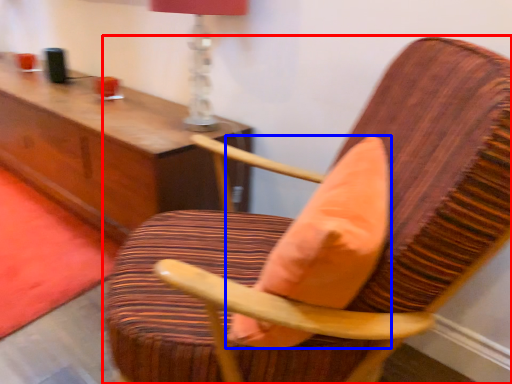
Question: Which of the following is the closest to the observer, chair (highlighted by a red box) or throw pillow (highlighted by a blue box)?

Choices:
 (A) chair
 (B) throw pillow

Answer: (A)